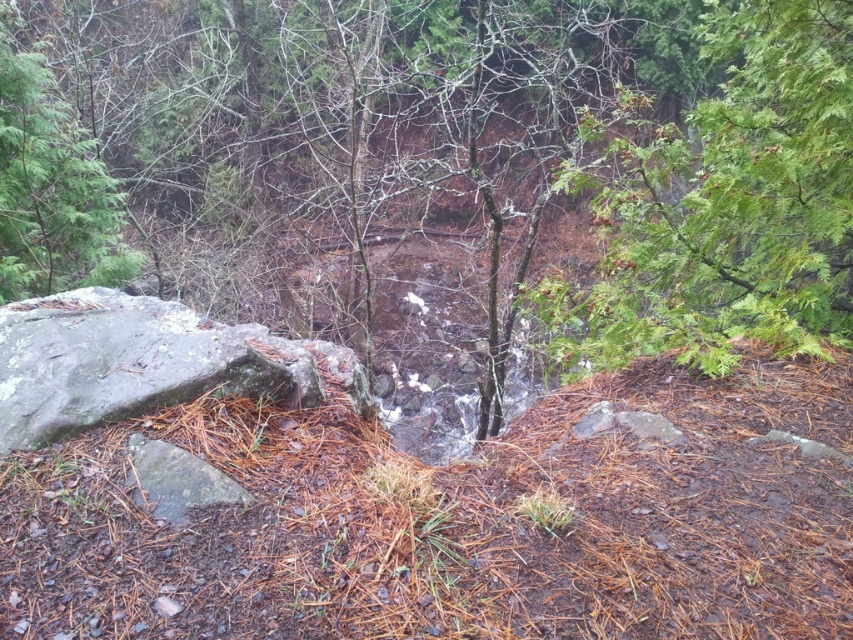
Is green textured tree at center positioned in front of green leafy tree at upper right?

No, green textured tree at center is further to the viewer.

Can you confirm if green textured tree at center is positioned to the right of green leafy tree at upper right?

No, green textured tree at center is not to the right of green leafy tree at upper right.

Is point (444, 42) farther from camera compared to point (761, 204)?

Yes, point (444, 42) is farther from viewer.

The image size is (853, 640). What are the coordinates of `green textured tree at center` in the screenshot? It's located at (498, 148).

Can you confirm if green textured tree at center is bigger than green matte tree at upper left?

Correct, green textured tree at center is larger in size than green matte tree at upper left.

Does point (572, 173) come closer to viewer compared to point (26, 282)?

That is True.

The image size is (853, 640). In order to click on green textured tree at center in this screenshot , I will do `click(498, 148)`.

Between green leafy tree at upper right and green matte tree at upper left, which one appears on the right side from the viewer's perspective?

green leafy tree at upper right is more to the right.

Is point (653, 301) farther from camera compared to point (102, 205)?

No, (653, 301) is closer to viewer.

The image size is (853, 640). Find the location of `green leafy tree at upper right`. green leafy tree at upper right is located at coordinates (726, 204).